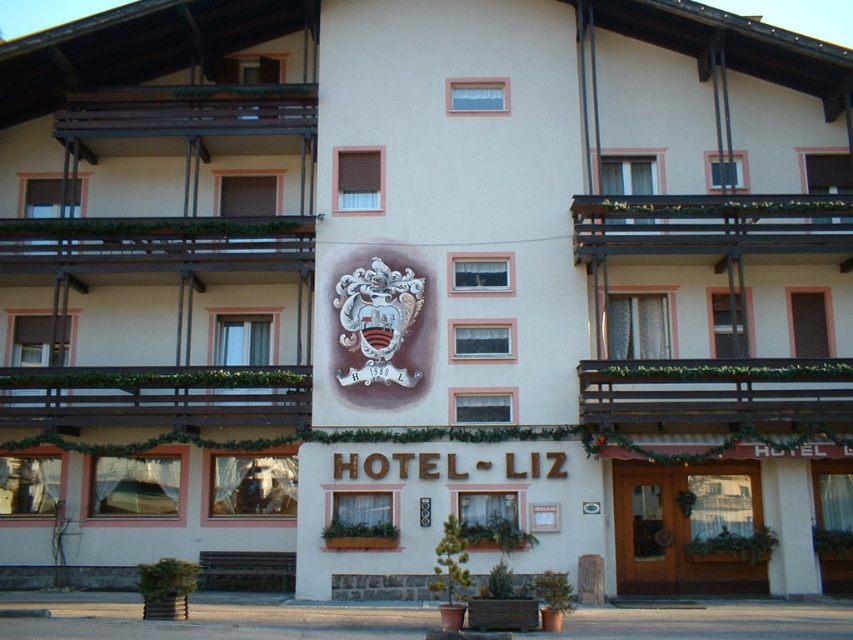
Is point (51, 113) closer to camera compared to point (341, 289)?

No, (51, 113) is behind (341, 289).

Between white stucco building at center and silver metallic coat of arms at center, which one has less height?

silver metallic coat of arms at center is shorter.

Is point (47, 260) positioned behind point (369, 314)?

Yes, it is.

Locate an element on the screen. white stucco building at center is located at coordinates (155, 280).